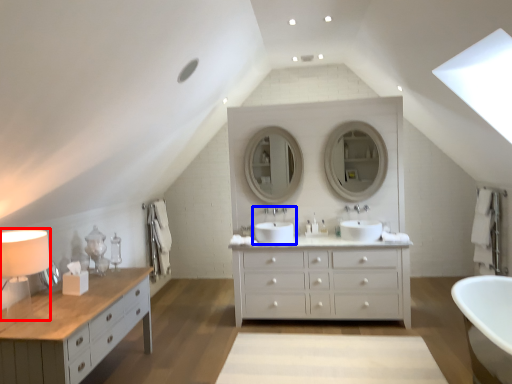
Question: Which of the following is the closest to the observer, table lamp (highlighted by a red box) or sink (highlighted by a blue box)?

Choices:
 (A) table lamp
 (B) sink

Answer: (A)